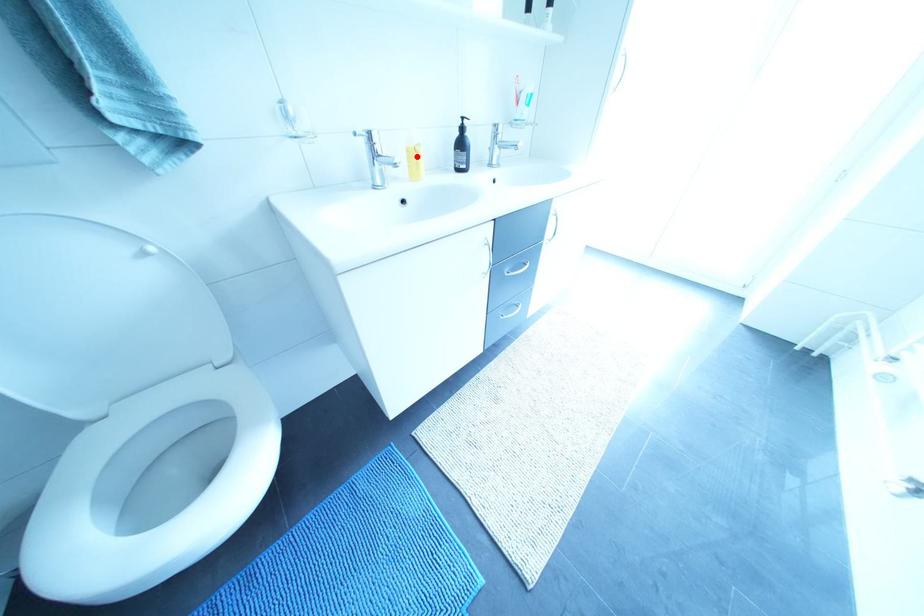
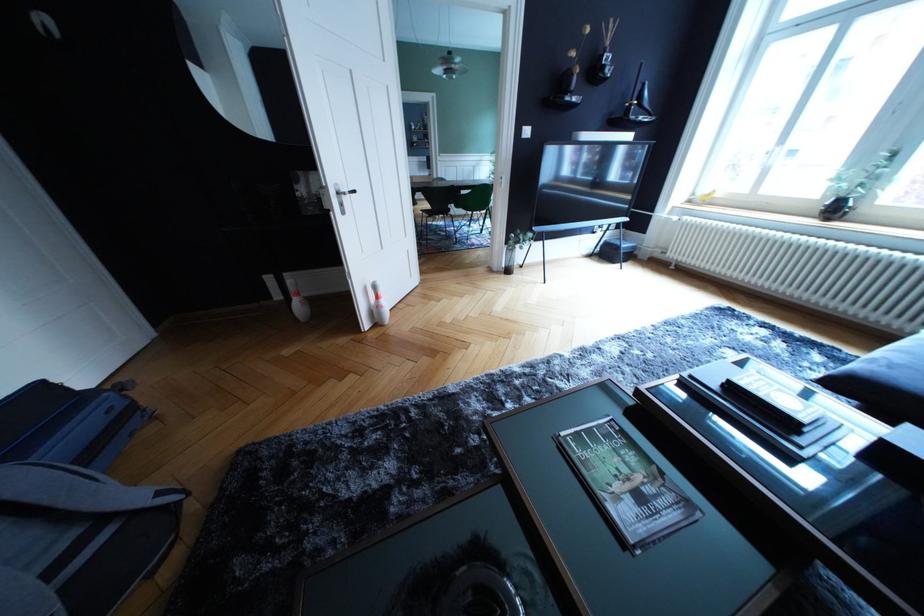
Question: I am providing you with two images of the same scene from different viewpoints. A red point is marked on the first image. At the location where the point appears in image 1, is it still visible in image 2?

Choices:
 (A) Yes
 (B) No

Answer: (B)